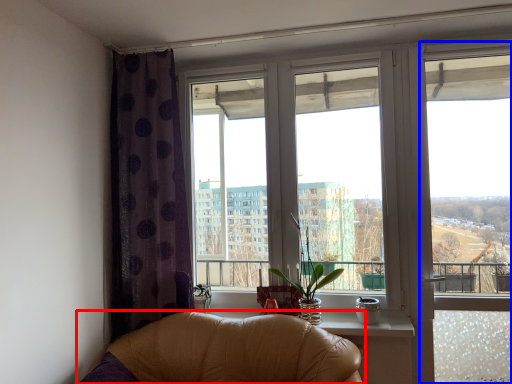
Question: Which point is closer to the camera, chair (highlighted by a red box) or window frame (highlighted by a blue box)?

Choices:
 (A) chair
 (B) window frame

Answer: (A)